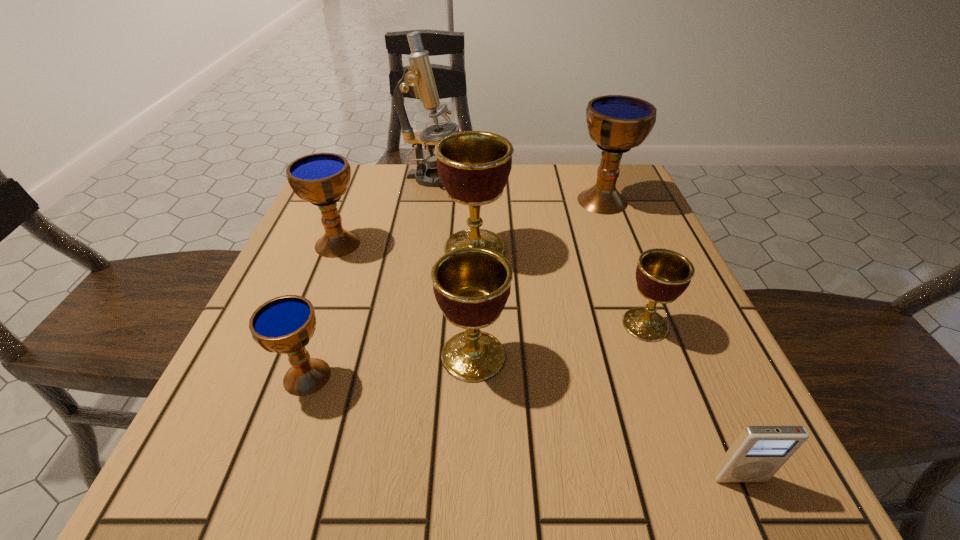
In order to click on iPod that is at the right edge in this screenshot , I will do `click(758, 452)`.

Identify the location of object present at the far right corner. The width and height of the screenshot is (960, 540). (616, 123).

Identify the location of object positioned at the near right corner. (758, 452).

Identify the location of free space at the far edge of the desktop. This screenshot has width=960, height=540. [525, 199].

Locate an element on the screen. Image resolution: width=960 pixels, height=540 pixels. free region at the near edge of the desktop is located at coordinates (482, 445).

At what (x,y) coordinates should I click in order to perform the action: click on free point at the left edge. Please return your answer as a coordinate pair (x, y). Looking at the image, I should click on (258, 356).

Locate an element on the screen. The image size is (960, 540). free space at the right edge of the desktop is located at coordinates (729, 372).

I want to click on blank space at the near left corner, so click(x=291, y=476).

The width and height of the screenshot is (960, 540). In the image, there is a desktop. Find the location of `vacant space at the far right corner`. vacant space at the far right corner is located at coordinates (592, 164).

The height and width of the screenshot is (540, 960). In order to click on vacant region at the near right corner in this screenshot , I will do pos(684,434).